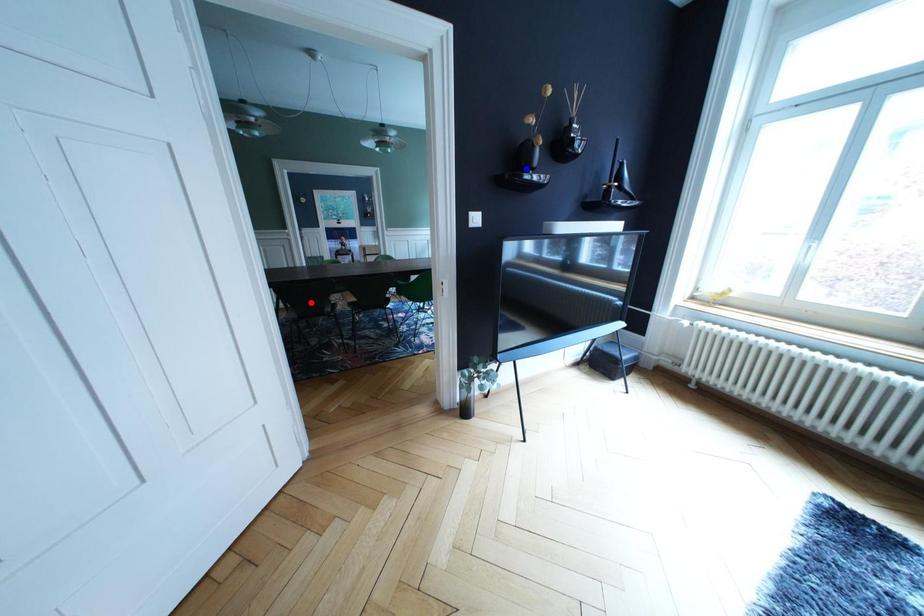
Question: Two points are marked on the image. Which point is closer to the camera?

Choices:
 (A) Blue point is closer.
 (B) Red point is closer.

Answer: (A)